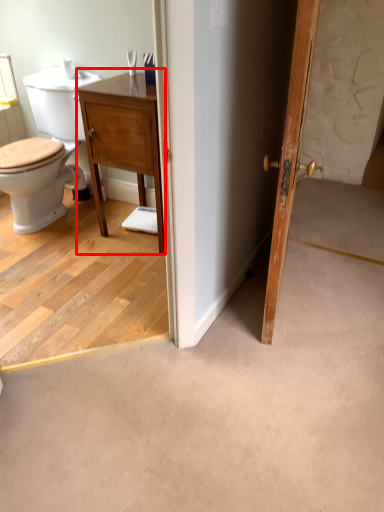
Question: From the image's perspective, where is vanity (annotated by the red box) located relative to door?

Choices:
 (A) above
 (B) below

Answer: (A)